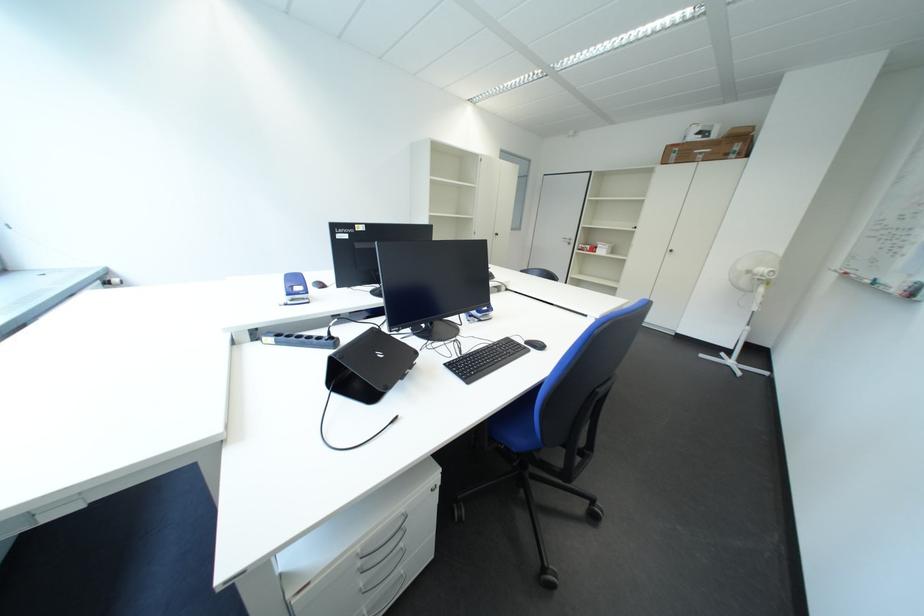
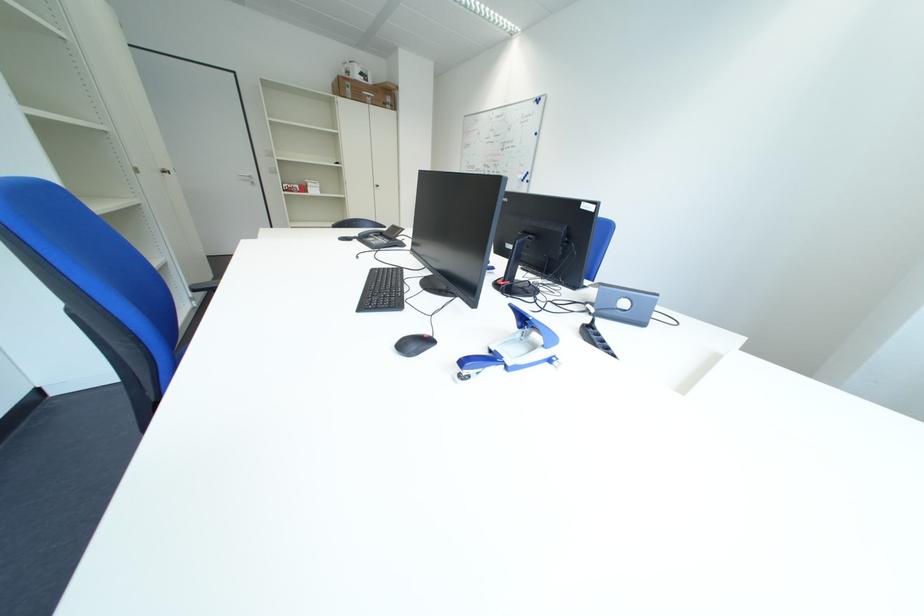
The point at (686, 158) is marked in the first image. Where is the corresponding point in the second image?

(360, 92)